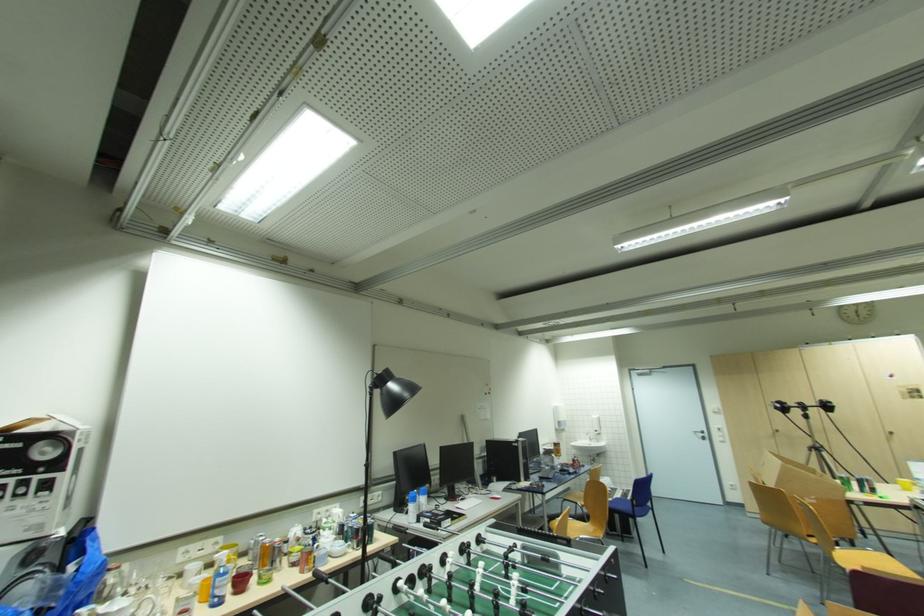
What do you see at coordinates (392, 390) in the screenshot?
I see `a black lamp head` at bounding box center [392, 390].